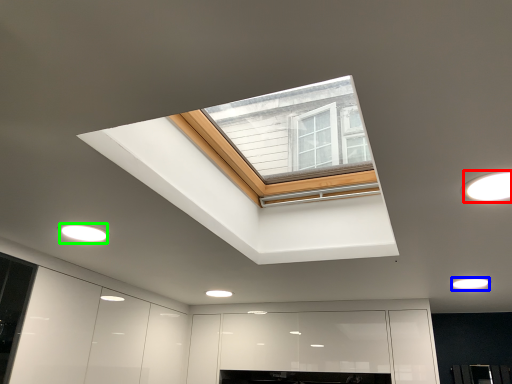
Question: Which object is positioned farthest from lighting (highlighted by a red box)? Select from lighting (highlighted by a blue box) and lighting (highlighted by a green box).

Choices:
 (A) lighting
 (B) lighting

Answer: (B)